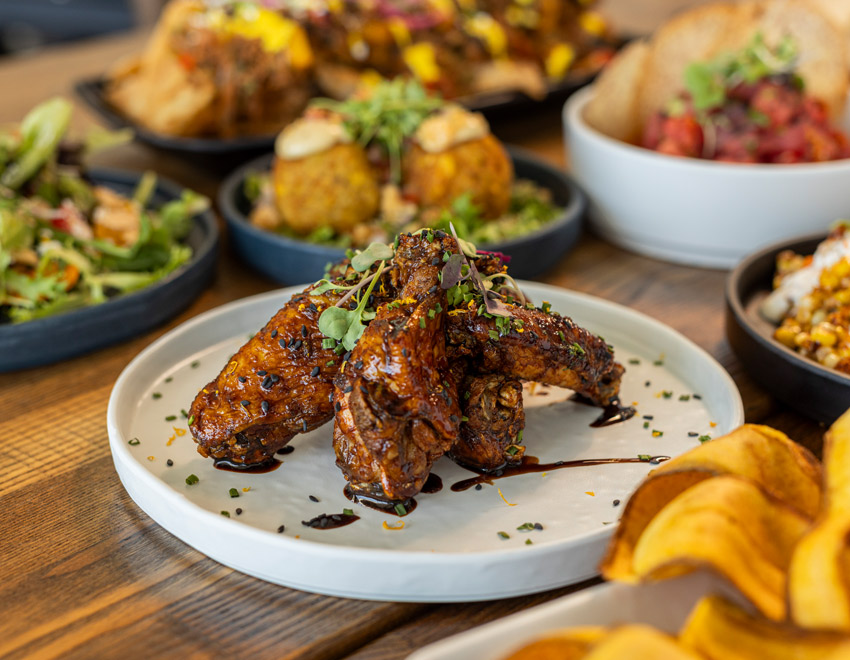
At what (x,y) coordinates should I click in order to perform the action: click on white bowl. Please return your answer as a coordinate pair (x, y). The height and width of the screenshot is (660, 850). Looking at the image, I should click on (692, 197).